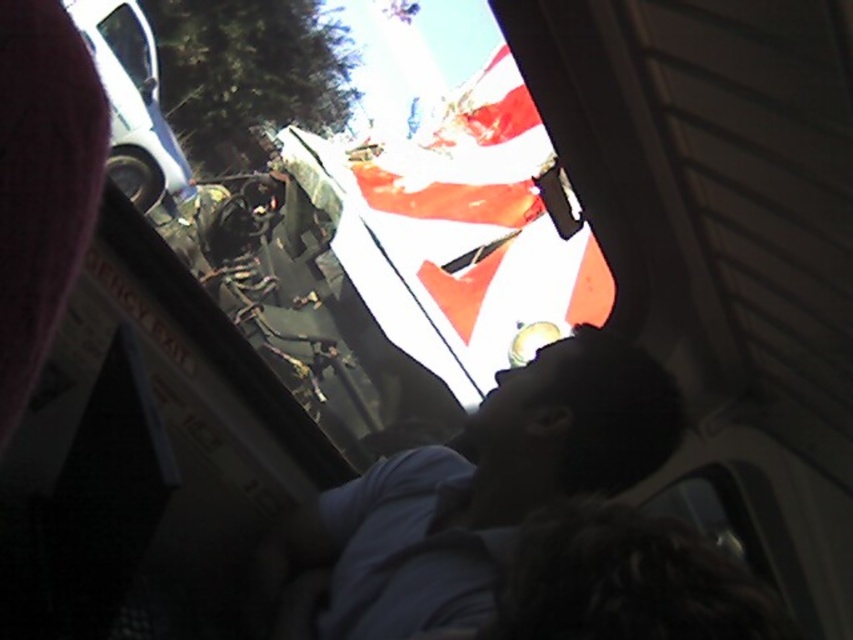
You are a passenger in a bus and you notice two items in your field of view. One is the dark blue shirt at center and the other is the transparent glass bus window at upper left. Which item takes up more space in your view?

The dark blue shirt at center takes up more space in your view because it is bigger than the transparent glass bus window at upper left.

You are a passenger in a bus and you notice the dark blue shirt at center and the transparent glass bus window at upper left. Which object is closer to the left side of the bus?

The transparent glass bus window at upper left is closer to the left side of the bus because the dark blue shirt at center is to the right of it.

You are a passenger in a bus and notice two objects in your field of view. You see the dark blue shirt at center and the transparent glass bus window at upper left. Which object is nearer to you?

The dark blue shirt at center is closer to the viewer than the transparent glass bus window at upper left.